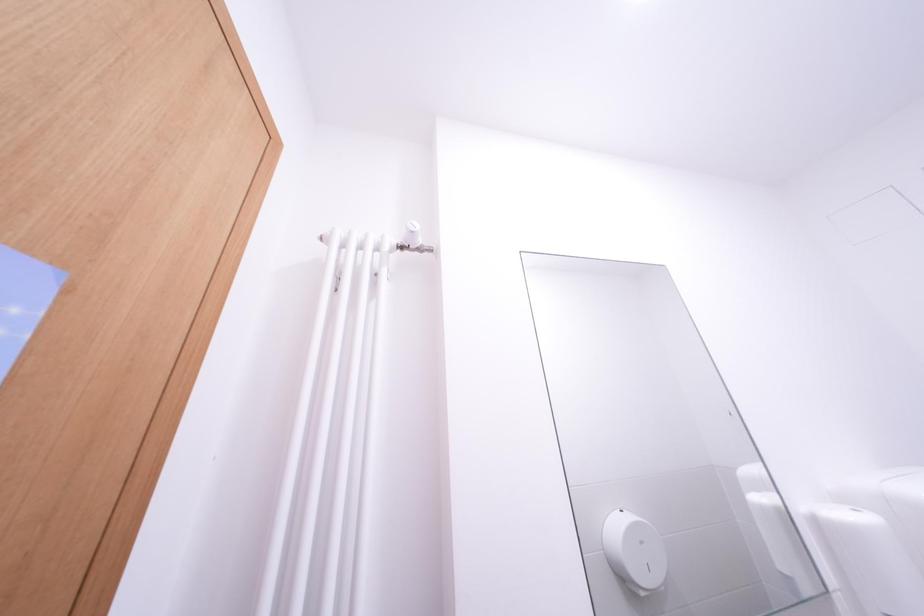
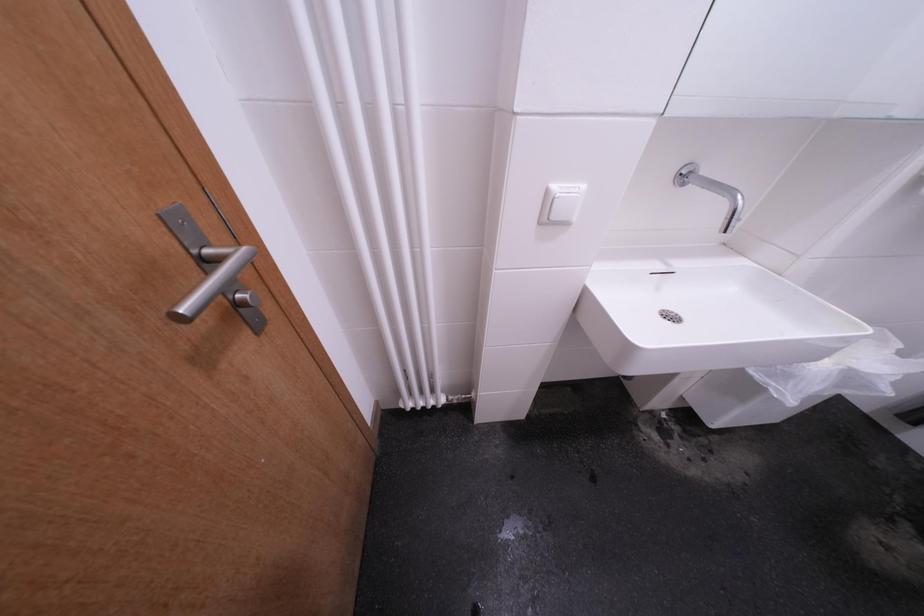
Question: How did the camera likely rotate?

Choices:
 (A) Left
 (B) Right
 (C) Up
 (D) Down

Answer: (D)